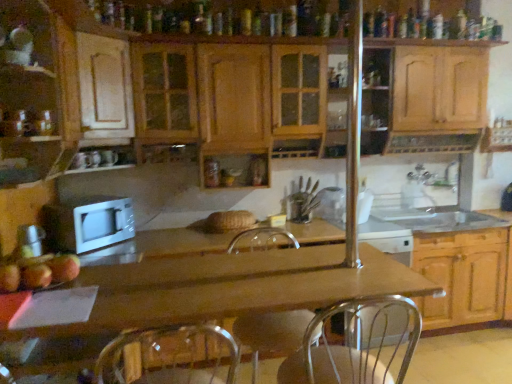
Question: Is silver metallic faucet at upper right, arranged as the first faucet when viewed from the right, located within metallic silver swivel chair at center?

Choices:
 (A) no
 (B) yes

Answer: (A)

Question: Considering the relative sizes of metallic silver swivel chair at center and silver metallic faucet at upper right, positioned as the second faucet in left-to-right order, in the image provided, is metallic silver swivel chair at center smaller than silver metallic faucet at upper right, positioned as the second faucet in left-to-right order,?

Choices:
 (A) no
 (B) yes

Answer: (A)

Question: Is metallic silver swivel chair at center turned away from silver metallic faucet at upper right, positioned as the second faucet in left-to-right order?

Choices:
 (A) no
 (B) yes

Answer: (A)

Question: Are metallic silver swivel chair at center and silver metallic faucet at upper right, arranged as the first faucet when viewed from the right, making contact?

Choices:
 (A) yes
 (B) no

Answer: (B)

Question: Considering the relative positions of metallic silver swivel chair at center and silver metallic faucet at upper right, arranged as the first faucet when viewed from the right, in the image provided, is metallic silver swivel chair at center in front of silver metallic faucet at upper right, arranged as the first faucet when viewed from the right,?

Choices:
 (A) no
 (B) yes

Answer: (B)

Question: In terms of size, does red matte apple at lower left appear bigger or smaller than white matte microwave at center?

Choices:
 (A) big
 (B) small

Answer: (B)

Question: Considering the positions of red matte apple at lower left and white matte microwave at center in the image, is red matte apple at lower left taller or shorter than white matte microwave at center?

Choices:
 (A) short
 (B) tall

Answer: (A)

Question: From a real-world perspective, is red matte apple at lower left positioned above or below white matte microwave at center?

Choices:
 (A) below
 (B) above

Answer: (B)

Question: From the image's perspective, is red matte apple at lower left located above or below white matte microwave at center?

Choices:
 (A) below
 (B) above

Answer: (A)

Question: Based on their sizes in the image, would you say wooden cabinet at lower right, which ranks as the first cabinetry in right-to-left order, is bigger or smaller than matte wood cabinet at left, acting as the third cabinetry starting from the right?

Choices:
 (A) big
 (B) small

Answer: (A)

Question: In terms of width, does wooden cabinet at lower right, the third cabinetry positioned from the left, look wider or thinner when compared to matte wood cabinet at left, acting as the third cabinetry starting from the right?

Choices:
 (A) wide
 (B) thin

Answer: (A)

Question: In the image, is wooden cabinet at lower right, the third cabinetry positioned from the left, positioned in front of or behind matte wood cabinet at left, the 1th cabinetry from the left?

Choices:
 (A) front
 (B) behind

Answer: (B)

Question: Is wooden cabinet at lower right, the third cabinetry positioned from the left, to the left or to the right of matte wood cabinet at left, the 1th cabinetry from the left, in the image?

Choices:
 (A) left
 (B) right

Answer: (B)

Question: Is white matte microwave at center taller or shorter than wooden cabinet at lower right, the third cabinetry positioned from the left?

Choices:
 (A) short
 (B) tall

Answer: (A)

Question: Is point (104, 241) positioned closer to the camera than point (474, 256)?

Choices:
 (A) farther
 (B) closer

Answer: (B)